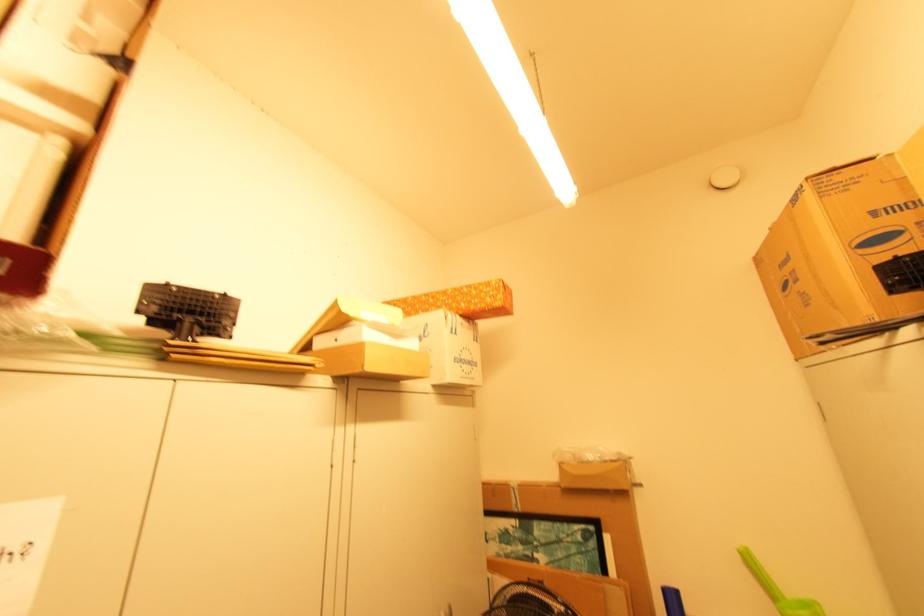
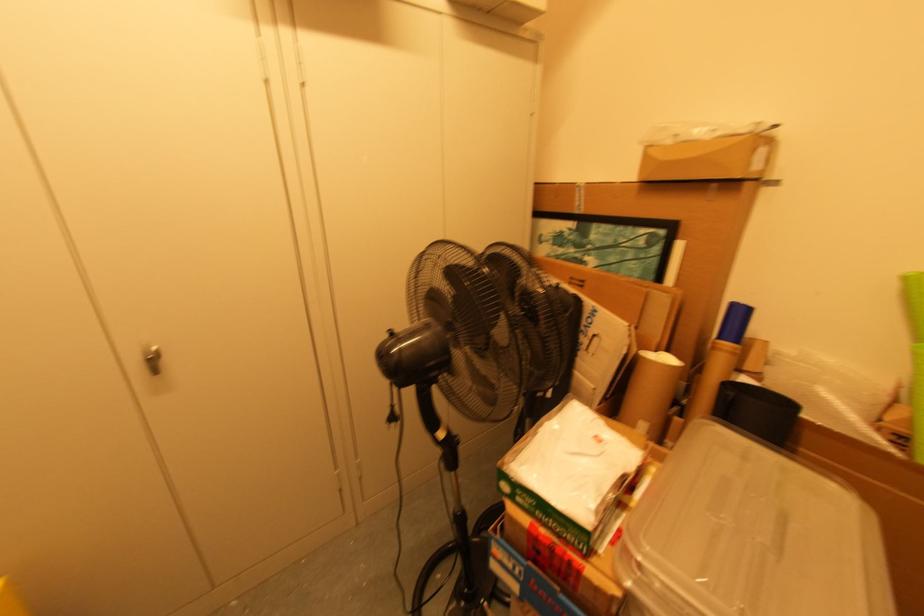
The images are taken continuously from a first-person perspective. In which direction is your viewpoint rotating?

The rotation direction of the camera is left-down.